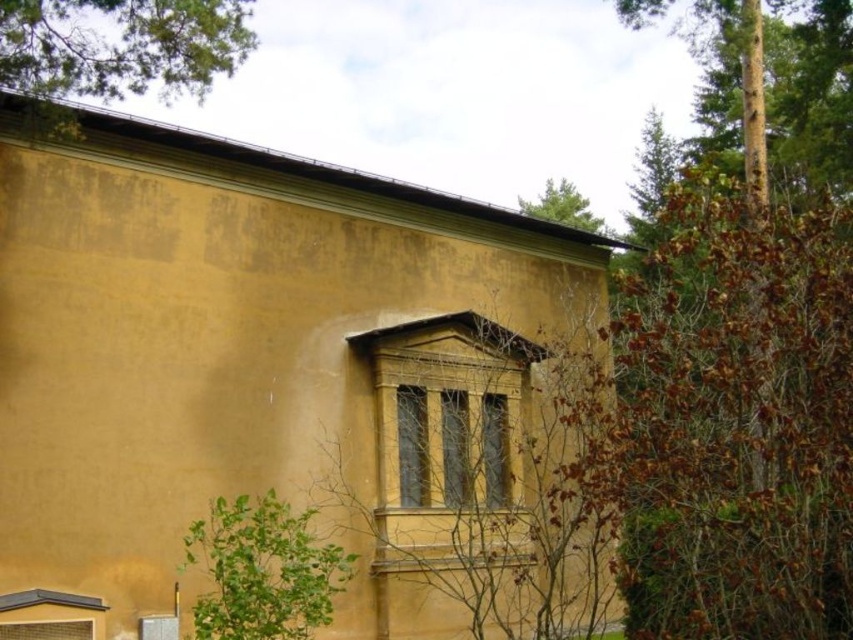
Question: Estimate the real-world distances between objects in this image. Which object is farther from the green leafy tree at upper left?

Choices:
 (A) green leafy tree at upper center
 (B) green leafy tree at lower left
 (C) brown rough bark tree at upper right

Answer: (A)

Question: Where is brown rough bark tree at upper right located in relation to green leafy tree at lower left in the image?

Choices:
 (A) left
 (B) right

Answer: (B)

Question: Which object is positioned farthest from the green leafy tree at lower left?

Choices:
 (A) green leafy tree at upper center
 (B) green leafy tree at upper left
 (C) brown rough bark tree at upper right

Answer: (A)

Question: Does green leafy tree at upper left appear under green leafy tree at lower left?

Choices:
 (A) no
 (B) yes

Answer: (A)

Question: Does green leafy tree at upper left appear under green leafy tree at lower left?

Choices:
 (A) yes
 (B) no

Answer: (B)

Question: Which of the following is the farthest from the observer?

Choices:
 (A) green leafy tree at upper center
 (B) brown rough bark tree at upper right
 (C) green leafy tree at upper left
 (D) green leafy tree at lower left

Answer: (A)